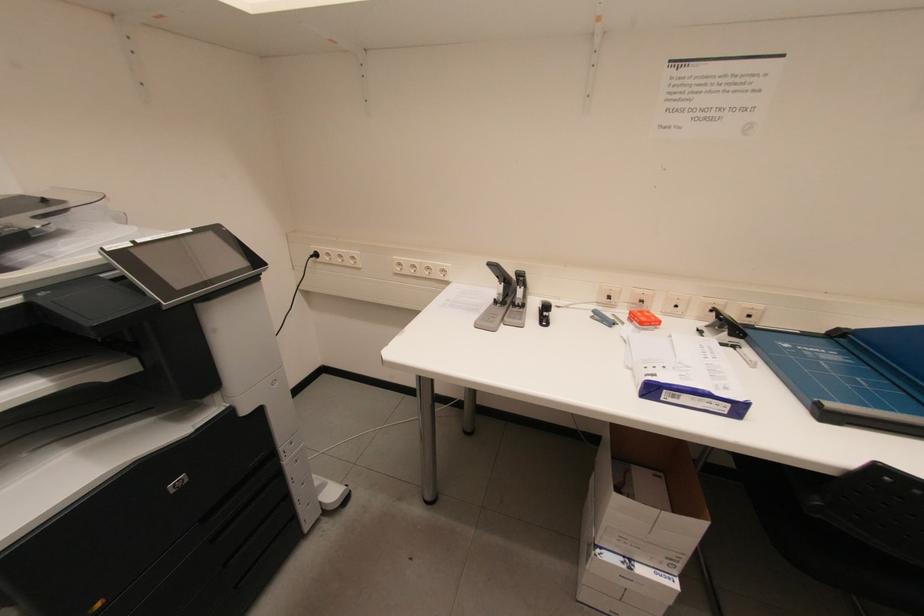
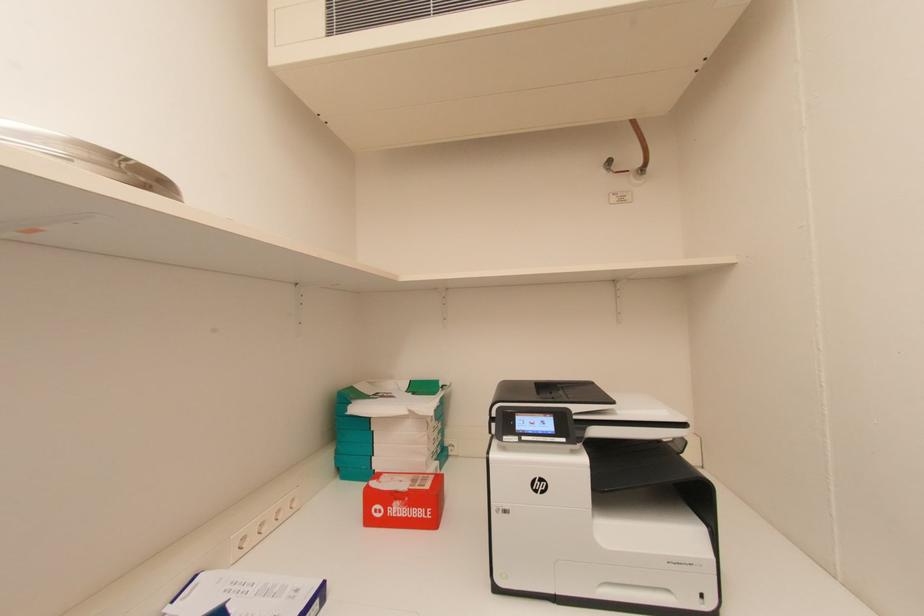
Question: The images are taken continuously from a first-person perspective. In which direction is your viewpoint rotating?

Choices:
 (A) Left
 (B) Right
 (C) Up
 (D) Down

Answer: (B)